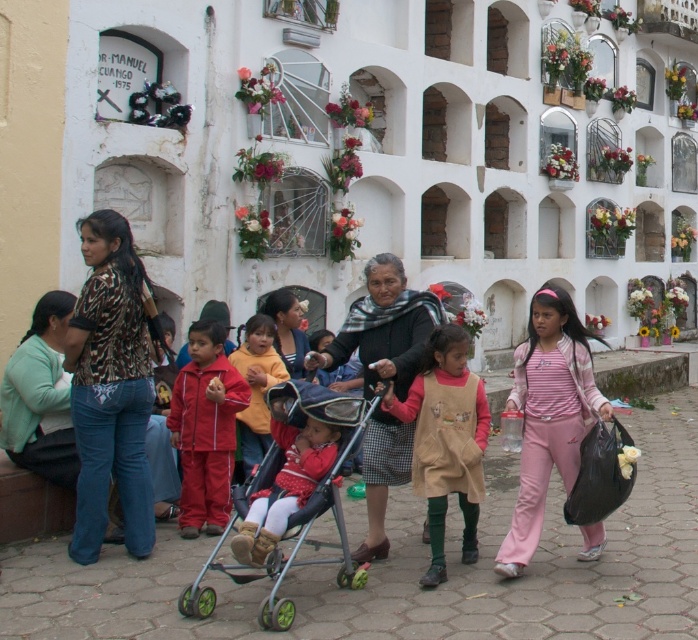
You are standing at the entrance of the cemetery and see the matte red stroller at center. If you walk straight ahead, will the stroller be directly in your path?

The matte red stroller at center is located at point (285,486), which is likely positioned in the central area of the image. Since you are walking straight ahead from the entrance, the stroller would be directly in your path.

You are standing in front of the cemetery wall and want to take a photo of both the point at coordinates point [339,339] and point [467,464]. Which point is closer to you?

Point [339,339] is further to the camera than point [467,464], so the point [467,464] is closer to you.